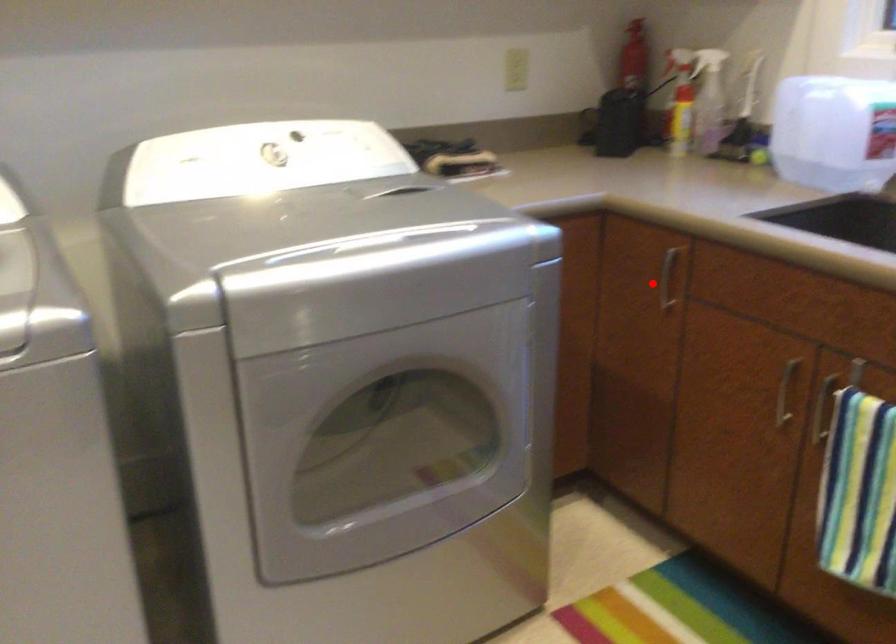
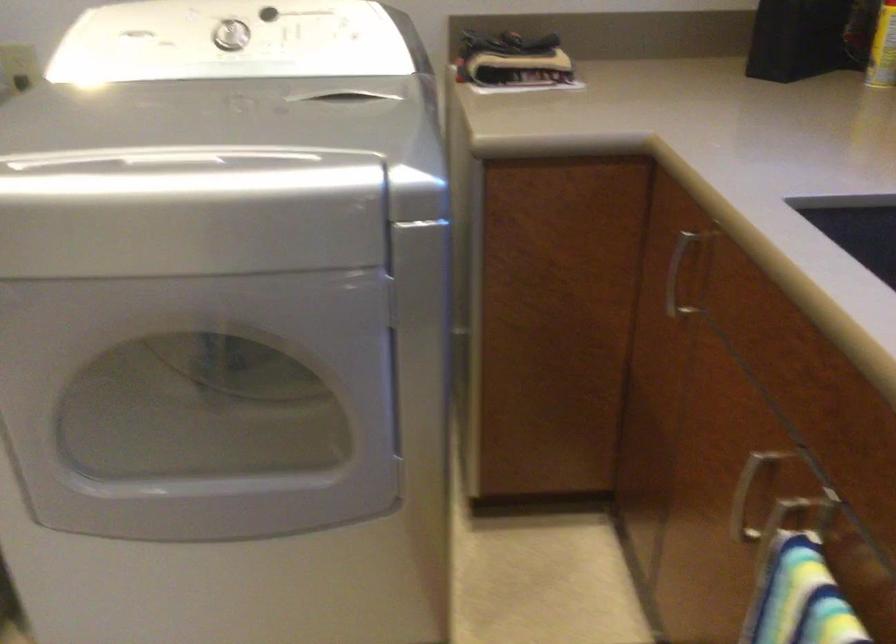
In the second image, find the point that corresponds to the highlighted location in the first image.

(677, 275)